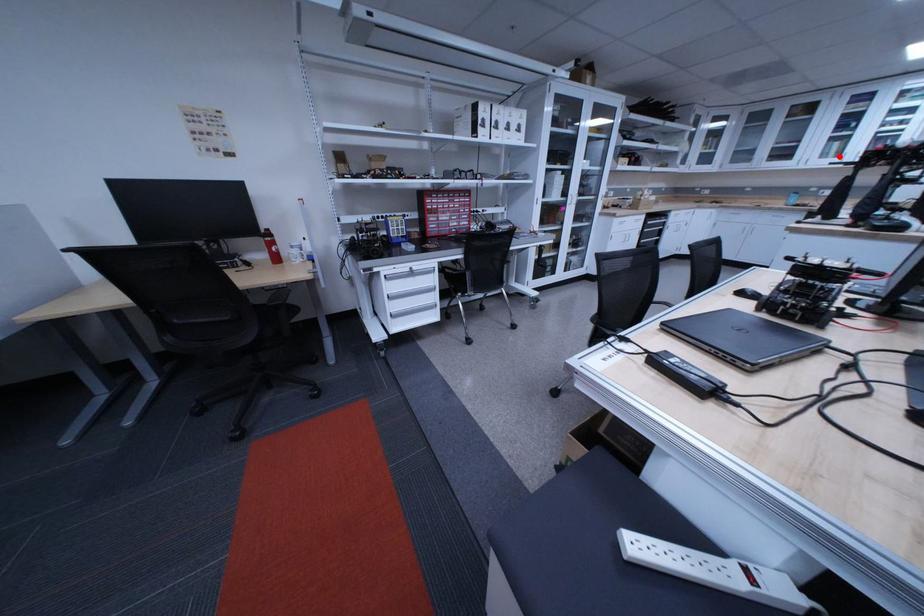
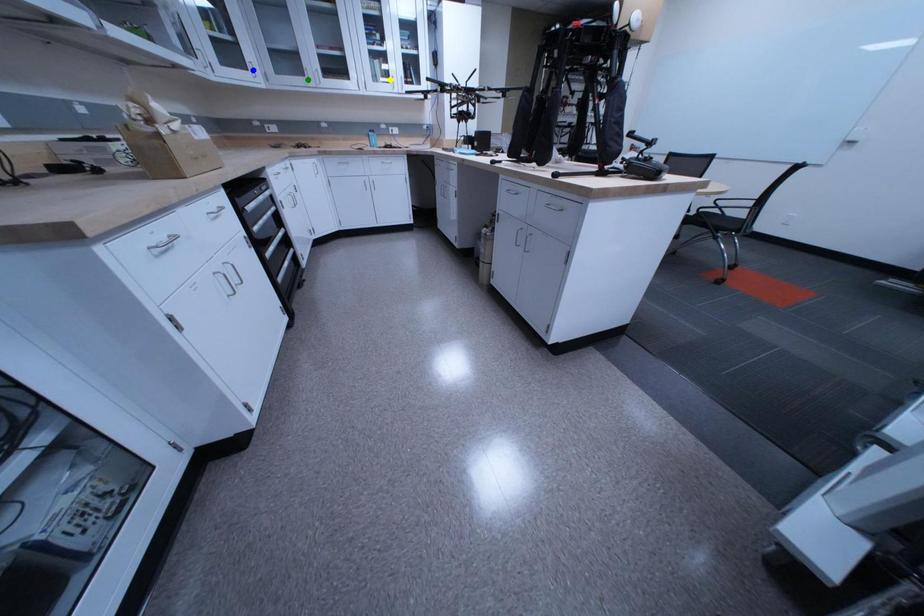
Question: I am providing you with two images of the same scene from different viewpoints. A red point is marked on the first image. You are given multiple points on the second image. Which mark in image 2 goes with the point in image 1?

Choices:
 (A) green point
 (B) blue point
 (C) yellow point

Answer: (C)